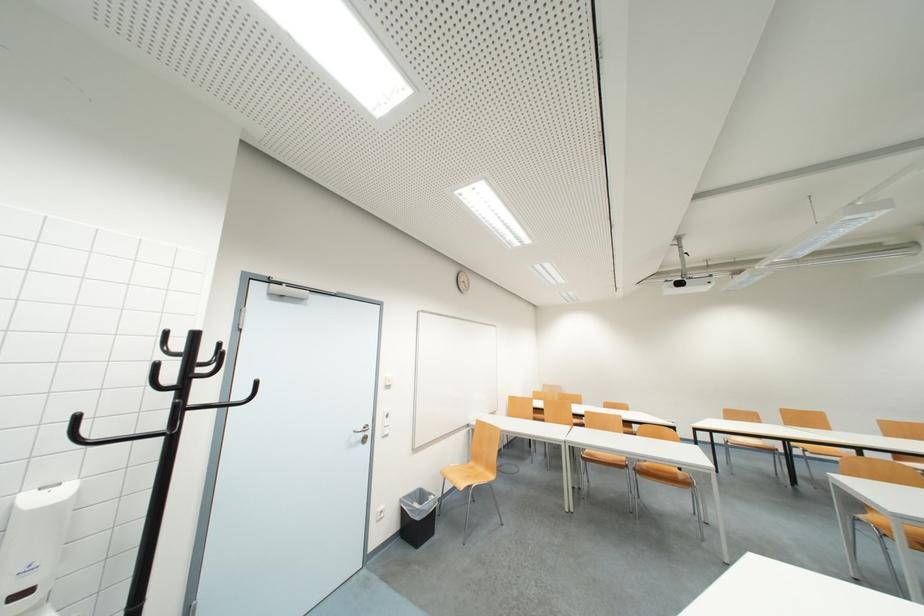
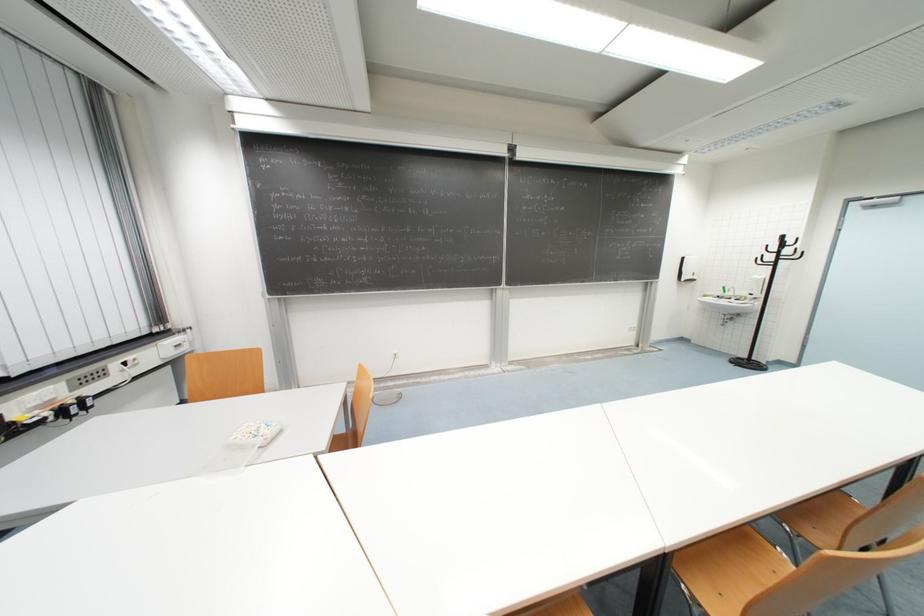
Find the pixel in the second image that matches (200,338) in the first image.

(789, 238)